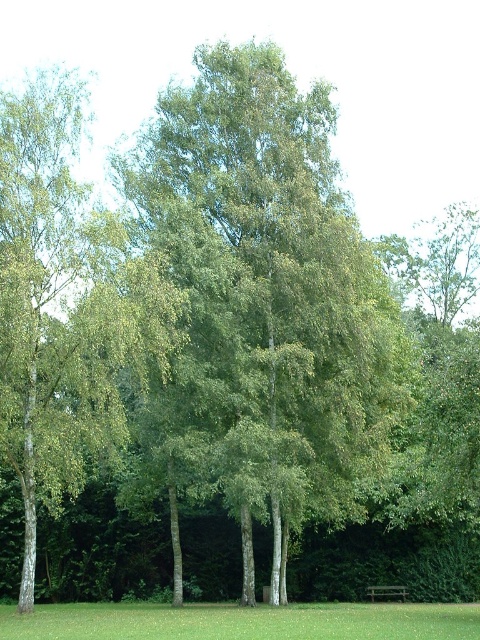
Question: Which point is farther to the camera?

Choices:
 (A) (377, 588)
 (B) (60, 636)

Answer: (A)

Question: Among these objects, which one is farthest from the camera?

Choices:
 (A) green grass at lower center
 (B) green smooth tree at center
 (C) wooden park bench at lower center

Answer: (C)

Question: Which object is farther from the camera taking this photo?

Choices:
 (A) wooden park bench at lower center
 (B) green smooth tree at center
 (C) green grass at lower center

Answer: (A)

Question: Is green grass at lower center positioned before wooden park bench at lower center?

Choices:
 (A) yes
 (B) no

Answer: (A)

Question: Can you confirm if green grass at lower center is smaller than wooden park bench at lower center?

Choices:
 (A) yes
 (B) no

Answer: (B)

Question: Is green grass at lower center below wooden park bench at lower center?

Choices:
 (A) yes
 (B) no

Answer: (B)